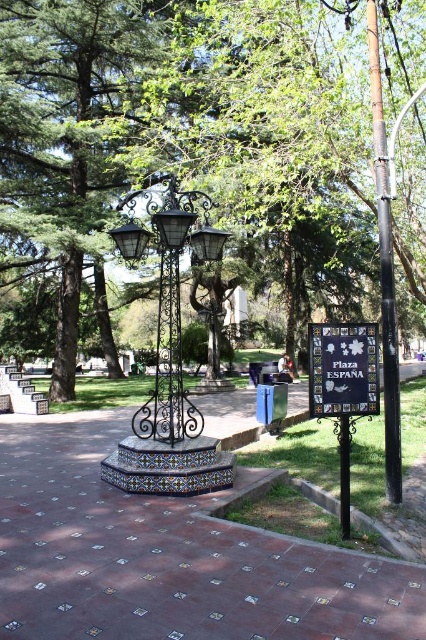
Question: Considering the real-world distances, which object is farthest from the black plastic sign at center?

Choices:
 (A) black wrought iron pole at center
 (B) black matte pole at right
 (C) terracotta tiles at center
 (D) green leafy tree at center

Answer: (D)

Question: From the image, what is the correct spatial relationship of green leafy tree at center in relation to black matte pole at right?

Choices:
 (A) left
 (B) right

Answer: (B)

Question: Which of the following is the closest to the observer?

Choices:
 (A) black wrought iron street light at center
 (B) black wrought iron pole at center

Answer: (B)

Question: Does black wrought iron street light at center appear under black matte pole at right?

Choices:
 (A) yes
 (B) no

Answer: (B)

Question: From the image, what is the correct spatial relationship of green leafy tree at center in relation to black wrought iron pole at center?

Choices:
 (A) left
 (B) right

Answer: (B)

Question: Which point is farther to the camera?

Choices:
 (A) green leafy tree at center
 (B) terracotta tiles at center
 (C) black wrought iron pole at center
 (D) black wrought iron street light at center

Answer: (A)